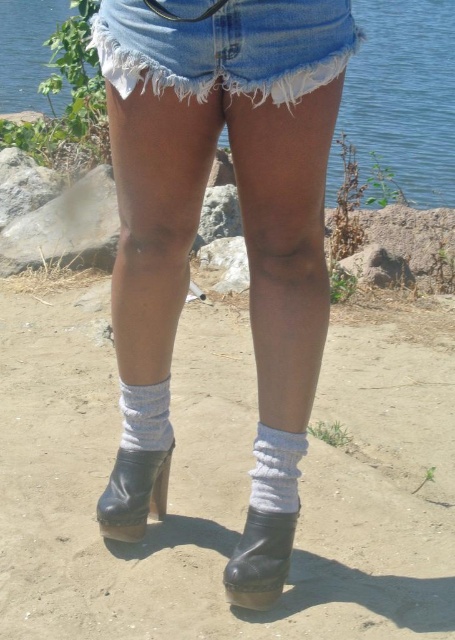
Who is positioned more to the left, white cotton shorts at upper center or black leather boot at lower center?

white cotton shorts at upper center

Is point (274, 24) less distant than point (259, 593)?

That is True.

Image resolution: width=455 pixels, height=640 pixels. In order to click on white cotton shorts at upper center in this screenshot , I will do `click(225, 45)`.

Between white cotton shorts at upper center and white knitted sock at lower center, which one appears on the right side from the viewer's perspective?

white cotton shorts at upper center

Which is behind, point (267, 26) or point (141, 420)?

The point (141, 420) is more distant.

The width and height of the screenshot is (455, 640). What do you see at coordinates (225, 45) in the screenshot?
I see `white cotton shorts at upper center` at bounding box center [225, 45].

Locate an element on the screen. white cotton shorts at upper center is located at coordinates (225, 45).

Is point (429, 45) positioned in front of point (147, 460)?

No, (429, 45) is behind (147, 460).

Where is `blue denim shorts at upper center`? blue denim shorts at upper center is located at coordinates (404, 93).

Between point (419, 144) and point (152, 513), which one is positioned behind?

The point (419, 144) is more distant.

At what (x,y) coordinates should I click in order to perform the action: click on blue denim shorts at upper center. Please return your answer as a coordinate pair (x, y). This screenshot has height=640, width=455. Looking at the image, I should click on (404, 93).